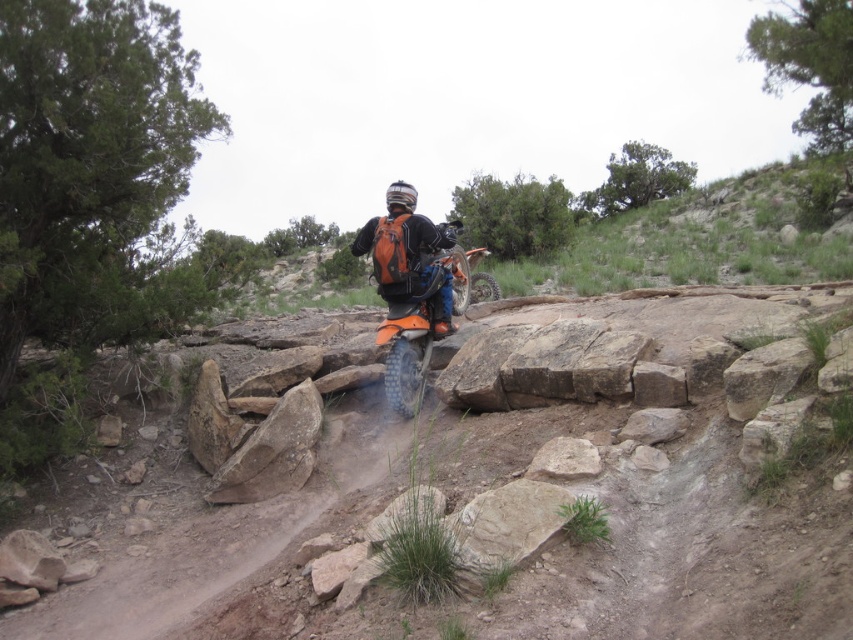
Is dusty gravel dirt track at center shorter than orange matte backpack at center?

Indeed, dusty gravel dirt track at center has a lesser height compared to orange matte backpack at center.

Can you confirm if dusty gravel dirt track at center is taller than orange matte backpack at center?

Incorrect, dusty gravel dirt track at center's height is not larger of orange matte backpack at center's.

Identify the location of dusty gravel dirt track at center. The image size is (853, 640). (688, 554).

Does dusty gravel dirt track at center have a larger size compared to orange matte dirt bike at center?

Yes, dusty gravel dirt track at center is bigger than orange matte dirt bike at center.

Between dusty gravel dirt track at center and orange matte dirt bike at center, which one has more height?

orange matte dirt bike at center is taller.

Between point (715, 324) and point (456, 308), which one is positioned in front?

Point (715, 324) is more forward.

Where is `dusty gravel dirt track at center`? This screenshot has width=853, height=640. dusty gravel dirt track at center is located at coordinates (688, 554).

Who is lower down, orange matte dirt bike at center or orange matte backpack at center?

orange matte dirt bike at center is lower down.

Who is taller, orange matte dirt bike at center or orange matte backpack at center?

With more height is orange matte dirt bike at center.

Describe the element at coordinates (424, 323) in the screenshot. This screenshot has height=640, width=853. I see `orange matte dirt bike at center` at that location.

The image size is (853, 640). What are the coordinates of `orange matte dirt bike at center` in the screenshot? It's located at (424, 323).